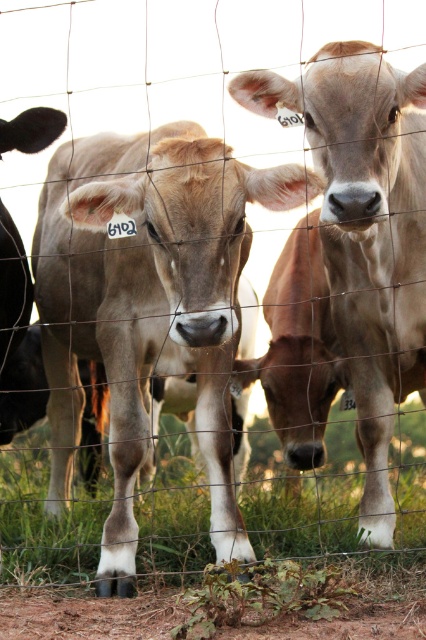
Question: Does smooth tan bull at center have a larger size compared to green grass at lower center?

Choices:
 (A) no
 (B) yes

Answer: (A)

Question: Is smooth tan bull at center positioned before green grass at lower center?

Choices:
 (A) no
 (B) yes

Answer: (B)

Question: Which of the following is the farthest from the observer?

Choices:
 (A) green grass at lower center
 (B) smooth tan bull at center

Answer: (A)

Question: Can you confirm if smooth tan bull at center is bigger than green grass at lower center?

Choices:
 (A) yes
 (B) no

Answer: (B)